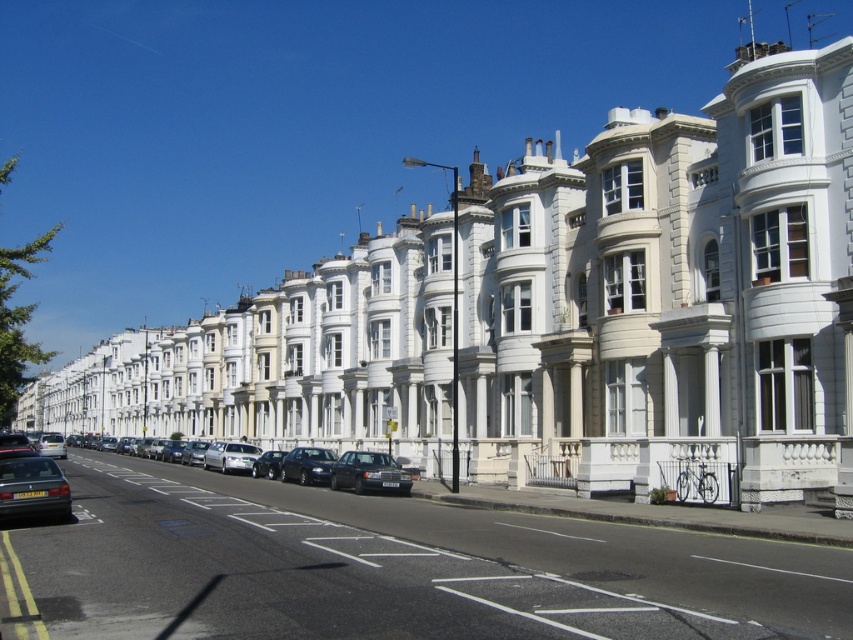
You are a delivery driver who needs to park your van, which is 6 meters long, in this street. You see a shiny silver sedan at center and a shiny silver car at center. Which vehicle can you park next to without exceeding the parking space? Please explain your reasoning based on their sizes.

The shiny silver sedan at center is larger in size than the shiny silver car at center. Since your van is 6 meters long, you should park next to the smaller shiny silver car at center to ensure there is enough space without exceeding the parking space.